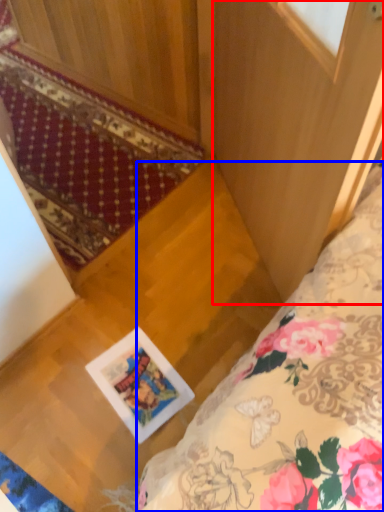
Question: Among these objects, which one is nearest to the camera, screen door (highlighted by a red box) or bed (highlighted by a blue box)?

Choices:
 (A) screen door
 (B) bed

Answer: (A)